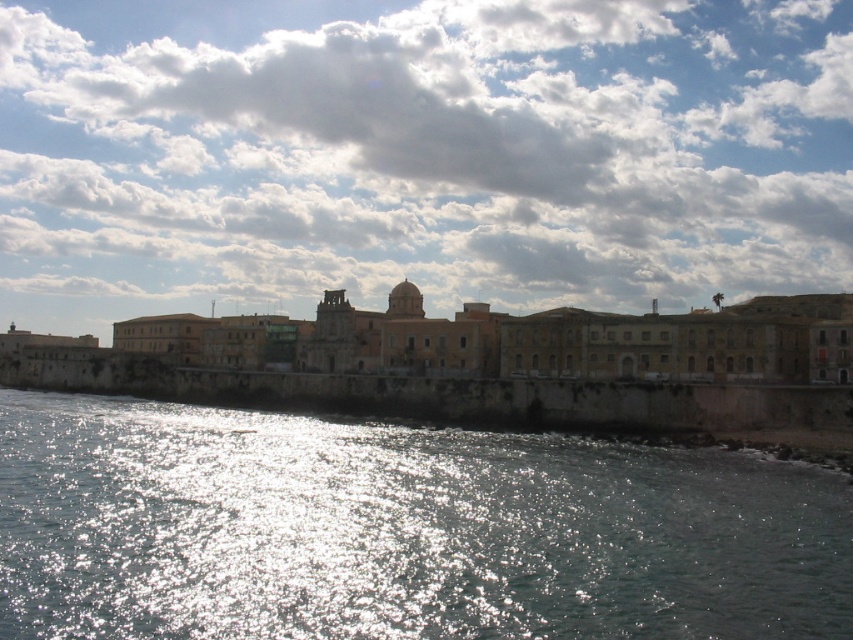
Question: Is cloudy sky at upper center above glistening water at lower left?

Choices:
 (A) yes
 (B) no

Answer: (A)

Question: Is cloudy sky at upper center smaller than glistening water at lower left?

Choices:
 (A) no
 (B) yes

Answer: (A)

Question: Among these points, which one is nearest to the camera?

Choices:
 (A) (817, 42)
 (B) (222, 529)

Answer: (B)

Question: Does cloudy sky at upper center have a lesser width compared to glistening water at lower left?

Choices:
 (A) yes
 (B) no

Answer: (B)